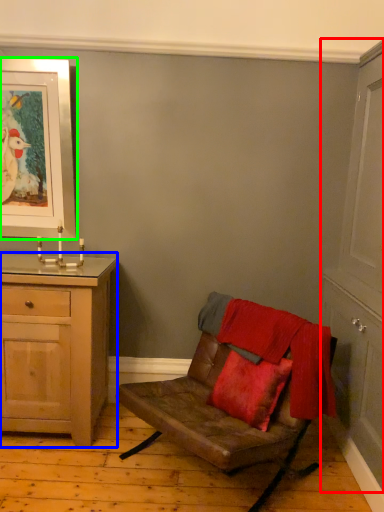
Question: Based on their relative distances, which object is nearer to cabinetry (highlighted by a red box)? Choose from chest of drawers (highlighted by a blue box) and picture frame (highlighted by a green box).

Choices:
 (A) chest of drawers
 (B) picture frame

Answer: (A)